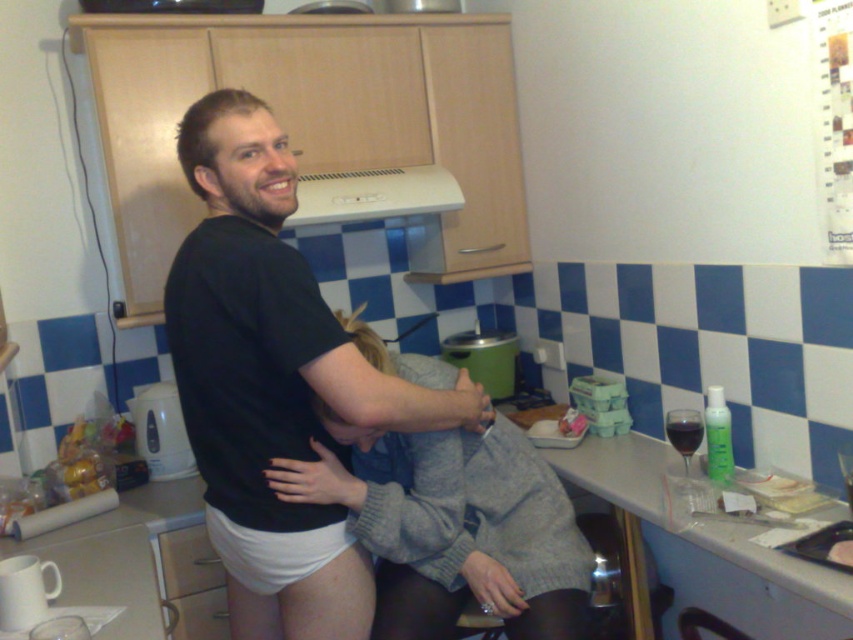
From the picture: Can you confirm if gray sweater at center is thinner than white plastic exhaust hood at upper center?

No, gray sweater at center is not thinner than white plastic exhaust hood at upper center.

Can you confirm if gray sweater at center is smaller than white plastic exhaust hood at upper center?

Incorrect, gray sweater at center is not smaller in size than white plastic exhaust hood at upper center.

Find the location of a particular element. This screenshot has height=640, width=853. gray sweater at center is located at coordinates (453, 528).

Can you confirm if gray sweater at center is wider than white laminate counter at center?

Yes, gray sweater at center is wider than white laminate counter at center.

Where is `gray sweater at center`? This screenshot has height=640, width=853. gray sweater at center is located at coordinates (453, 528).

Identify the location of gray sweater at center. This screenshot has height=640, width=853. (453, 528).

Is white matte underwear at center below white plastic exhaust hood at upper center?

Correct, white matte underwear at center is located below white plastic exhaust hood at upper center.

In the scene shown: Is white matte underwear at center to the left of white plastic exhaust hood at upper center from the viewer's perspective?

Indeed, white matte underwear at center is positioned on the left side of white plastic exhaust hood at upper center.

Does point (306, 605) come closer to viewer compared to point (387, 214)?

Yes, point (306, 605) is in front of point (387, 214).

At what (x,y) coordinates should I click in order to perform the action: click on white matte underwear at center. Please return your answer as a coordinate pair (x, y). This screenshot has width=853, height=640. Looking at the image, I should click on (271, 380).